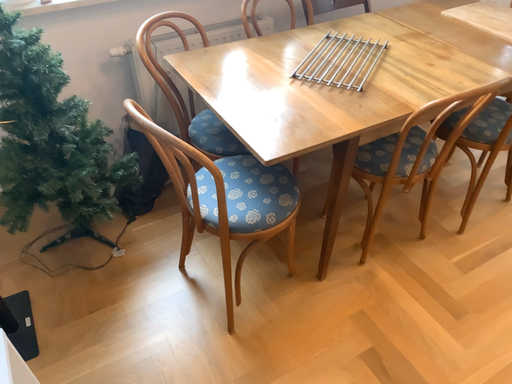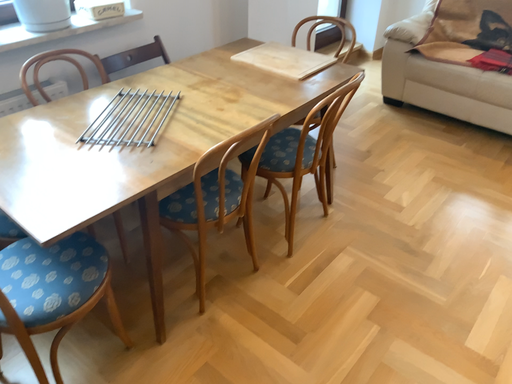
Question: How did the camera likely rotate when shooting the video?

Choices:
 (A) rotated left
 (B) rotated right

Answer: (B)